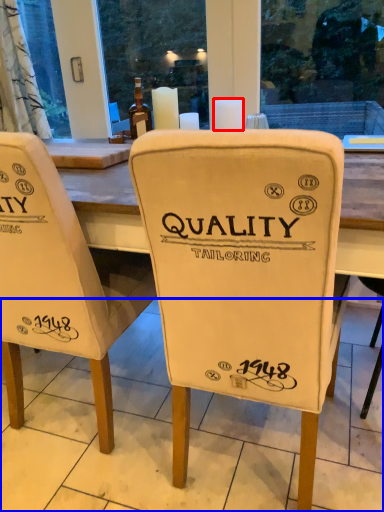
Question: Which of the following is the farthest to the observer, candle (highlighted by a red box) or tile (highlighted by a blue box)?

Choices:
 (A) candle
 (B) tile

Answer: (A)